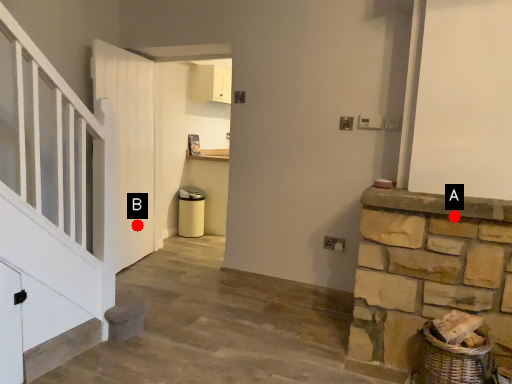
Question: Two points are circled on the image, labeled by A and B beside each circle. Which point appears farthest from the camera in this image?

Choices:
 (A) A is further
 (B) B is further

Answer: (B)